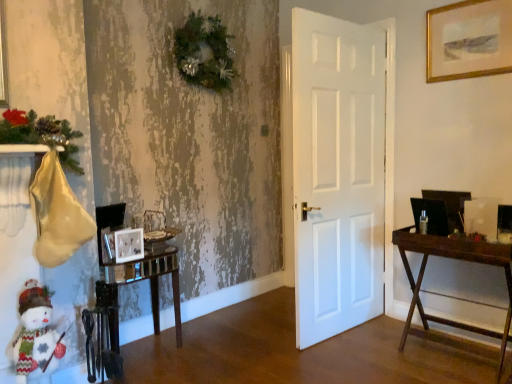
Question: From the image's perspective, would you say gold-framed artwork at upper right, the 1th picture frame in the right-to-left sequence, is shown under matte silver picture frame at lower left, placed as the third picture frame when sorted from right to left?

Choices:
 (A) no
 (B) yes

Answer: (A)

Question: Is gold-framed artwork at upper right, acting as the 1th picture frame starting from the top, at the left side of matte silver picture frame at lower left, which appears as the 1th picture frame when viewed from the left?

Choices:
 (A) no
 (B) yes

Answer: (A)

Question: Does gold-framed artwork at upper right, which is counted as the 3th picture frame, starting from the bottom, have a lesser height compared to matte silver picture frame at lower left, the 1th picture frame from the bottom?

Choices:
 (A) yes
 (B) no

Answer: (B)

Question: From a real-world perspective, is gold-framed artwork at upper right, the 3th picture frame from the left, positioned under matte silver picture frame at lower left, which is counted as the 3th picture frame, starting from the top, based on gravity?

Choices:
 (A) no
 (B) yes

Answer: (A)

Question: Is gold-framed artwork at upper right, the 1th picture frame in the right-to-left sequence, looking in the opposite direction of matte silver picture frame at lower left, the 1th picture frame from the bottom?

Choices:
 (A) yes
 (B) no

Answer: (B)

Question: Does point (221, 56) appear closer or farther from the camera than point (419, 304)?

Choices:
 (A) farther
 (B) closer

Answer: (A)

Question: From the image's perspective, is green textured wreath at upper center positioned above or below wooden desk at right?

Choices:
 (A) below
 (B) above

Answer: (B)

Question: Is green textured wreath at upper center inside or outside of wooden desk at right?

Choices:
 (A) outside
 (B) inside

Answer: (A)

Question: Would you say green textured wreath at upper center is to the left or to the right of wooden desk at right in the picture?

Choices:
 (A) left
 (B) right

Answer: (A)

Question: In the image, is matte white picture frame at lower left, the second picture frame when ordered from right to left, on the left side or the right side of clear glass table at lower left?

Choices:
 (A) left
 (B) right

Answer: (A)

Question: From the image's perspective, is matte white picture frame at lower left, the 2th picture frame positioned from the bottom, above or below clear glass table at lower left?

Choices:
 (A) below
 (B) above

Answer: (B)

Question: Based on their sizes in the image, would you say matte white picture frame at lower left, marked as the second picture frame in a top-to-bottom arrangement, is bigger or smaller than clear glass table at lower left?

Choices:
 (A) big
 (B) small

Answer: (B)

Question: Does point (138, 230) appear closer or farther from the camera than point (113, 339)?

Choices:
 (A) farther
 (B) closer

Answer: (A)

Question: Based on their sizes in the image, would you say gold-framed artwork at upper right, the 3th picture frame from the left, is bigger or smaller than green textured wreath at upper center?

Choices:
 (A) big
 (B) small

Answer: (B)

Question: From a real-world perspective, is gold-framed artwork at upper right, acting as the 1th picture frame starting from the top, physically located above or below green textured wreath at upper center?

Choices:
 (A) above
 (B) below

Answer: (B)